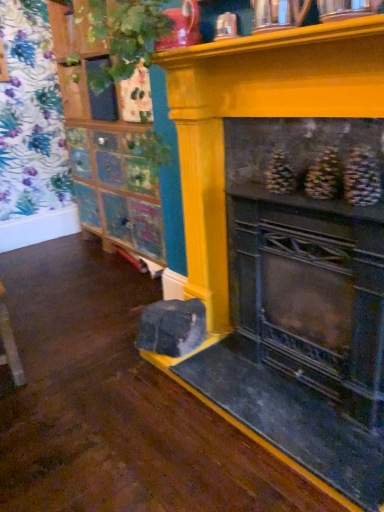
I want to click on yellow painted wood fireplace at center, so click(284, 246).

What do you see at coordinates (124, 37) in the screenshot? I see `green leafy plant at upper left` at bounding box center [124, 37].

What is the approximate height of green leafy plant at upper left?

The height of green leafy plant at upper left is 31.93 inches.

Measure the distance between point [78,119] and camera.

Point [78,119] and camera are 2.96 meters apart from each other.

The image size is (384, 512). Identify the location of wooden cabinet at upper left, the first shelf when ordered from front to back. (106, 140).

Identify the location of multicolored painted cabinet at left, the first shelf viewed from the left. (116, 186).

Can you confirm if wooden cabinet at upper left, the second shelf in the left-to-right sequence, is positioned to the left of yellow painted wood fireplace at center?

Indeed, wooden cabinet at upper left, the second shelf in the left-to-right sequence, is positioned on the left side of yellow painted wood fireplace at center.

From the picture: Is wooden cabinet at upper left, the first shelf when ordered from front to back, positioned behind yellow painted wood fireplace at center?

Yes.

Where is `fireplace located on the right of wooden cabinet at upper left, the second shelf in the left-to-right sequence`? The image size is (384, 512). fireplace located on the right of wooden cabinet at upper left, the second shelf in the left-to-right sequence is located at coordinates (284, 246).

Considering the relative sizes of wooden cabinet at upper left, the second shelf in the left-to-right sequence, and yellow painted wood fireplace at center in the image provided, is wooden cabinet at upper left, the second shelf in the left-to-right sequence, bigger than yellow painted wood fireplace at center?

No, wooden cabinet at upper left, the second shelf in the left-to-right sequence, is not bigger than yellow painted wood fireplace at center.

From the image's perspective, who appears lower, multicolored painted cabinet at left, which is the 1th shelf from back to front, or green leafy plant at upper left?

multicolored painted cabinet at left, which is the 1th shelf from back to front.

From a real-world perspective, is multicolored painted cabinet at left, the first shelf viewed from the left, located higher than green leafy plant at upper left?

No, from a real-world perspective, multicolored painted cabinet at left, the first shelf viewed from the left, is not over green leafy plant at upper left

Who is smaller, multicolored painted cabinet at left, the first shelf viewed from the left, or green leafy plant at upper left?

multicolored painted cabinet at left, the first shelf viewed from the left, is smaller.

Which of these two, multicolored painted cabinet at left, which is the 1th shelf from back to front, or green leafy plant at upper left, is thinner?

A: multicolored painted cabinet at left, which is the 1th shelf from back to front, is thinner.

Can you confirm if green leafy plant at upper left is taller than wooden cabinet at upper left, the second shelf in the left-to-right sequence?

Yes.

Consider the image. In the image, is green leafy plant at upper left on the left side or the right side of wooden cabinet at upper left, the first shelf when ordered from front to back?

In the image, green leafy plant at upper left appears on the left side of wooden cabinet at upper left, the first shelf when ordered from front to back.

From the image's perspective, is green leafy plant at upper left above or below wooden cabinet at upper left, the first shelf when ordered from front to back?

From the image's perspective, green leafy plant at upper left appears above wooden cabinet at upper left, the first shelf when ordered from front to back.

Does green leafy plant at upper left have a greater width compared to wooden cabinet at upper left, the second shelf when ordered from back to front?

Correct, the width of green leafy plant at upper left exceeds that of wooden cabinet at upper left, the second shelf when ordered from back to front.

Is multicolored painted cabinet at left, the first shelf viewed from the left, positioned far away from yellow painted wood fireplace at center?

That's right, there is a large distance between multicolored painted cabinet at left, the first shelf viewed from the left, and yellow painted wood fireplace at center.

Where is `shelf directly beneath the yellow painted wood fireplace at center (from a real-world perspective)`? The height and width of the screenshot is (512, 384). shelf directly beneath the yellow painted wood fireplace at center (from a real-world perspective) is located at coordinates (116, 186).

Based on the photo, is multicolored painted cabinet at left, the first shelf viewed from the left, aimed at yellow painted wood fireplace at center?

No, multicolored painted cabinet at left, the first shelf viewed from the left, does not turn towards yellow painted wood fireplace at center.

Considering the positions of point (272, 68) and point (109, 35), is point (272, 68) closer or farther from the camera than point (109, 35)?

Point (272, 68) is positioned closer to the camera compared to point (109, 35).

Based on their sizes in the image, would you say yellow painted wood fireplace at center is bigger or smaller than green leafy plant at upper left?

In the image, yellow painted wood fireplace at center appears to be smaller than green leafy plant at upper left.

How distant is yellow painted wood fireplace at center from green leafy plant at upper left?

28.34 inches.

Which is behind, point (93, 181) or point (133, 162)?

Point (93, 181)

Which is correct: multicolored painted cabinet at left, which is the 2th shelf from front to back, is inside wooden cabinet at upper left, the second shelf in the left-to-right sequence, or outside of it?

multicolored painted cabinet at left, which is the 2th shelf from front to back, cannot be found inside wooden cabinet at upper left, the second shelf in the left-to-right sequence.

From a real-world perspective, is multicolored painted cabinet at left, the first shelf viewed from the left, located higher than wooden cabinet at upper left, the 1th shelf from the right?

No, from a real-world perspective, multicolored painted cabinet at left, the first shelf viewed from the left, is not on top of wooden cabinet at upper left, the 1th shelf from the right.

Does multicolored painted cabinet at left, which is the 1th shelf from back to front, have a lesser width compared to wooden cabinet at upper left, the second shelf when ordered from back to front?

Correct, the width of multicolored painted cabinet at left, which is the 1th shelf from back to front, is less than that of wooden cabinet at upper left, the second shelf when ordered from back to front.

From the image's perspective, is wooden cabinet at upper left, the 1th shelf from the right, positioned above or below multicolored painted cabinet at left, the 2th shelf from the right?

Clearly, from the image's perspective, wooden cabinet at upper left, the 1th shelf from the right, is above multicolored painted cabinet at left, the 2th shelf from the right.

In terms of width, does wooden cabinet at upper left, the second shelf in the left-to-right sequence, look wider or thinner when compared to multicolored painted cabinet at left, the 2th shelf from the right?

Clearly, wooden cabinet at upper left, the second shelf in the left-to-right sequence, has more width compared to multicolored painted cabinet at left, the 2th shelf from the right.

In order to click on shelf in front of the multicolored painted cabinet at left, which is the 2th shelf from front to back in this screenshot , I will do `click(106, 140)`.

From a real-world perspective, who is located higher, wooden cabinet at upper left, the 1th shelf from the right, or multicolored painted cabinet at left, which is the 1th shelf from back to front?

In real-world perspective, wooden cabinet at upper left, the 1th shelf from the right, is above.

At what (x,y) coordinates should I click in order to perform the action: click on fireplace in front of the wooden cabinet at upper left, the second shelf when ordered from back to front. Please return your answer as a coordinate pair (x, y). Looking at the image, I should click on (284, 246).

Where is `plant above the multicolored painted cabinet at left, the 2th shelf from the right (from the image's perspective)`? The width and height of the screenshot is (384, 512). plant above the multicolored painted cabinet at left, the 2th shelf from the right (from the image's perspective) is located at coordinates (124, 37).

Based on their spatial positions, is wooden cabinet at upper left, the second shelf when ordered from back to front, or green leafy plant at upper left further from multicolored painted cabinet at left, which is the 2th shelf from front to back?

Among the two, green leafy plant at upper left is located further to multicolored painted cabinet at left, which is the 2th shelf from front to back.

Based on their spatial positions, is multicolored painted cabinet at left, which is the 1th shelf from back to front, or green leafy plant at upper left further from wooden cabinet at upper left, the first shelf when ordered from front to back?

green leafy plant at upper left lies further to wooden cabinet at upper left, the first shelf when ordered from front to back, than the other object.

When comparing their distances from yellow painted wood fireplace at center, does wooden cabinet at upper left, the second shelf in the left-to-right sequence, or green leafy plant at upper left seem closer?

The object closer to yellow painted wood fireplace at center is green leafy plant at upper left.

Considering their positions, is wooden cabinet at upper left, the second shelf when ordered from back to front, positioned closer to multicolored painted cabinet at left, the first shelf viewed from the left, than yellow painted wood fireplace at center?

wooden cabinet at upper left, the second shelf when ordered from back to front.

When comparing their distances from green leafy plant at upper left, does yellow painted wood fireplace at center or multicolored painted cabinet at left, the 2th shelf from the right, seem further?

multicolored painted cabinet at left, the 2th shelf from the right.

Considering their positions, is wooden cabinet at upper left, the second shelf in the left-to-right sequence, positioned further to green leafy plant at upper left than multicolored painted cabinet at left, the first shelf viewed from the left?

Based on the image, multicolored painted cabinet at left, the first shelf viewed from the left, appears to be further to green leafy plant at upper left.

Considering their positions, is wooden cabinet at upper left, the second shelf when ordered from back to front, positioned further to yellow painted wood fireplace at center than multicolored painted cabinet at left, which is the 2th shelf from front to back?

Based on the image, multicolored painted cabinet at left, which is the 2th shelf from front to back, appears to be further to yellow painted wood fireplace at center.

Considering their positions, is green leafy plant at upper left positioned closer to yellow painted wood fireplace at center than wooden cabinet at upper left, the second shelf in the left-to-right sequence?

green leafy plant at upper left is closer to yellow painted wood fireplace at center.

What are the coordinates of `shelf between yellow painted wood fireplace at center and green leafy plant at upper left from front to back` in the screenshot? It's located at (106, 140).

At what (x,y) coordinates should I click in order to perform the action: click on plant between yellow painted wood fireplace at center and multicolored painted cabinet at left, the 2th shelf from the right, in the front-back direction. Please return your answer as a coordinate pair (x, y). The width and height of the screenshot is (384, 512). Looking at the image, I should click on (124, 37).

Find the location of a particular element. The height and width of the screenshot is (512, 384). plant positioned between wooden cabinet at upper left, the second shelf in the left-to-right sequence, and multicolored painted cabinet at left, the first shelf viewed from the left, from near to far is located at coordinates (124, 37).

Image resolution: width=384 pixels, height=512 pixels. What are the coordinates of `shelf between yellow painted wood fireplace at center and multicolored painted cabinet at left, the 2th shelf from the right, in the front-back direction` in the screenshot? It's located at (106, 140).